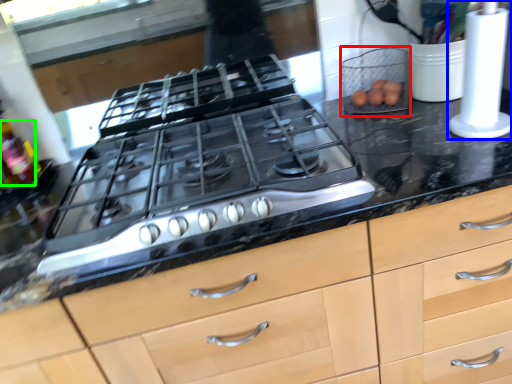
Question: Which object is the closest to the appliance (highlighted by a red box)? Choose among these: kitchen appliance (highlighted by a blue box) or bottle (highlighted by a green box).

Choices:
 (A) kitchen appliance
 (B) bottle

Answer: (A)